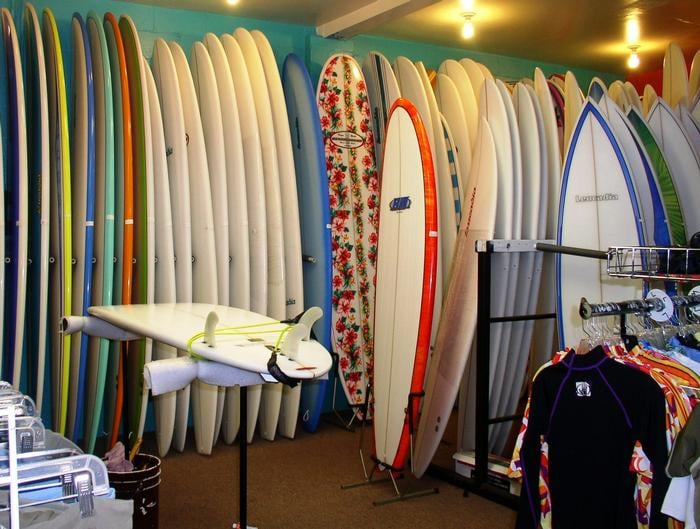
The height and width of the screenshot is (529, 700). I want to click on surfboard stand, so click(211, 368).